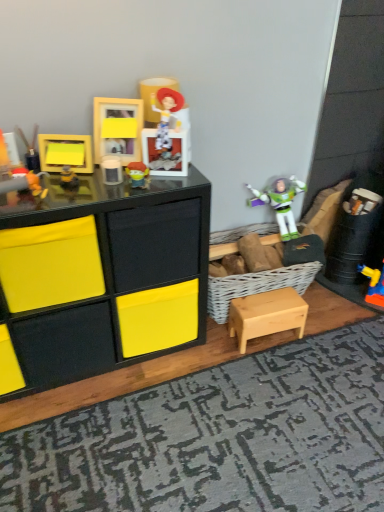
What are the coordinates of `free space on the front side of yellow matte frame at upper left, the fourth toy when ordered from right to left` in the screenshot? It's located at (71, 185).